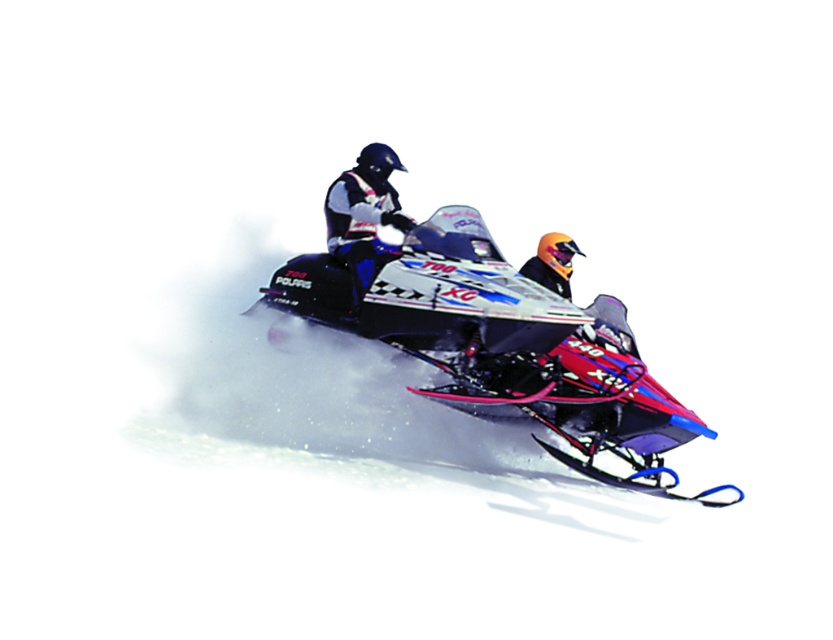
You are a photographer standing at the edge of a snowy field. You want to capture a closeup shot of the shiny metallic snowmobile at center. If your camera has a minimum focusing distance of 5 meters, will you be able to take the photo without moving closer?

The shiny metallic snowmobile at center is 4.95 meters from the camera, which is within the minimum focusing distance of 5 meters. Therefore, you can take the photo without moving closer.